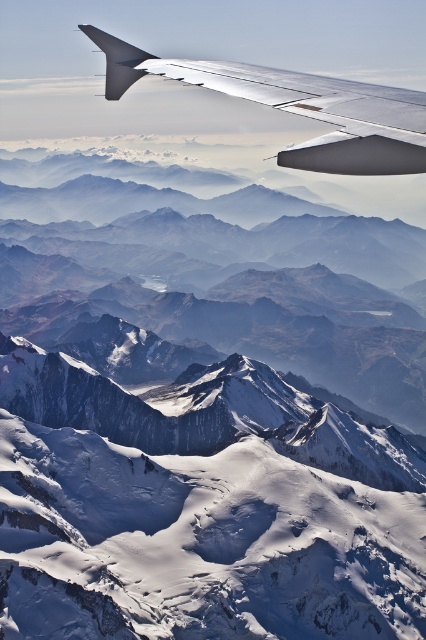
Question: Is white snow-covered mountain range at center below metallic silver wing at upper center?

Choices:
 (A) yes
 (B) no

Answer: (B)

Question: Is white snow-covered mountain range at center smaller than metallic silver wing at upper center?

Choices:
 (A) yes
 (B) no

Answer: (B)

Question: Considering the relative positions of white snow-covered mountain range at center and metallic silver wing at upper center in the image provided, where is white snow-covered mountain range at center located with respect to metallic silver wing at upper center?

Choices:
 (A) right
 (B) left

Answer: (A)

Question: Which point is closer to the camera taking this photo?

Choices:
 (A) (9, 196)
 (B) (112, 67)

Answer: (B)

Question: Which of the following is the closest to the observer?

Choices:
 (A) (325, 115)
 (B) (224, 339)

Answer: (A)

Question: Which of the following is the farthest from the observer?

Choices:
 (A) metallic silver wing at upper center
 (B) white snow-covered mountain range at center

Answer: (B)